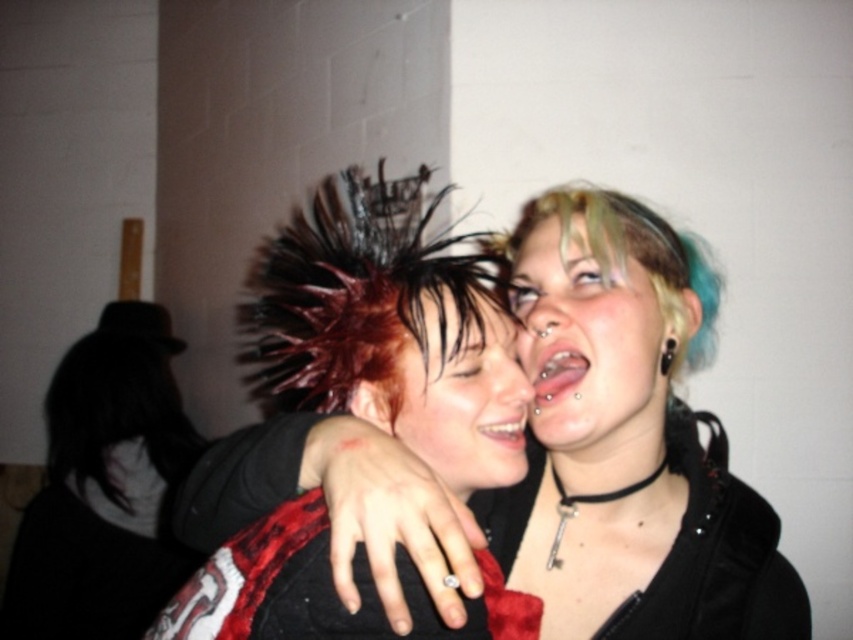
Question: Which point is closer to the camera?

Choices:
 (A) (410, 368)
 (B) (28, 557)
 (C) (699, 560)

Answer: (A)

Question: Which point appears farthest from the camera in this image?

Choices:
 (A) (154, 525)
 (B) (293, 524)
 (C) (405, 442)
 (D) (427, 300)

Answer: (A)

Question: Is shiny red hair at center to the left of velvet red dress at center from the viewer's perspective?

Choices:
 (A) no
 (B) yes

Answer: (A)

Question: Can you confirm if matte black jacket at center is positioned above black matte hat at upper left?

Choices:
 (A) yes
 (B) no

Answer: (A)

Question: Does matte black jacket at center lie in front of shiny silver necklace at upper right?

Choices:
 (A) yes
 (B) no

Answer: (A)

Question: Which object is positioned farthest from the black matte hat at upper left?

Choices:
 (A) matte black jacket at center
 (B) shiny red hair at center
 (C) shiny silver necklace at upper right

Answer: (B)